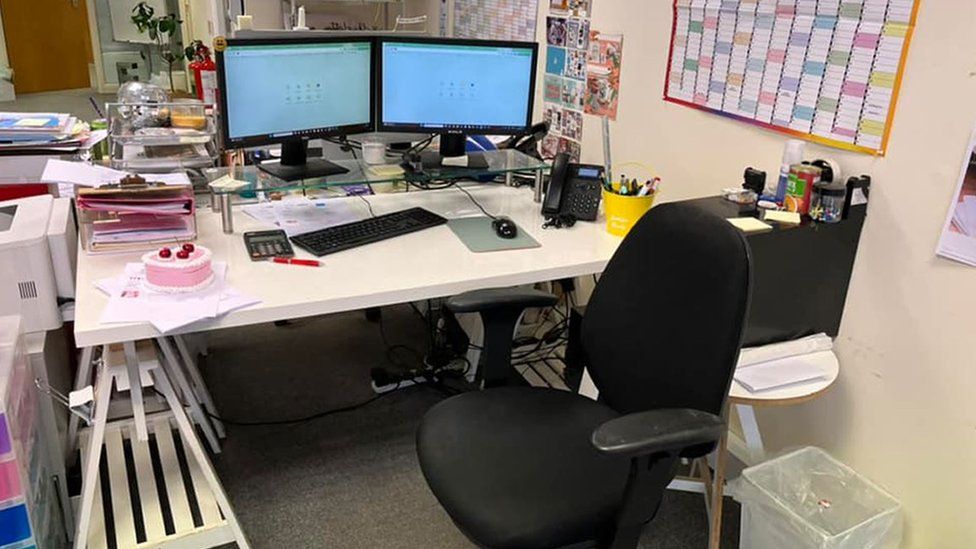
The image size is (976, 549). I want to click on monitors, so click(278, 107), click(483, 89).